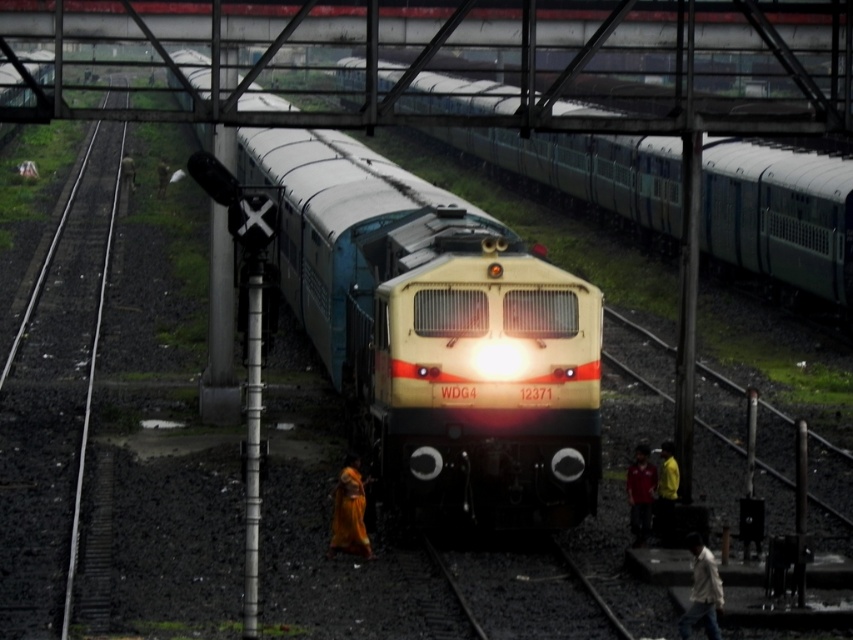
You are standing at the point marked by coordinates point (438, 333) in the railway scene. Which object is exactly at this location?

The point (438, 333) corresponds to the location of the matte yellow locomotive at center.

You are a railway engineer standing at the control center. You need to locate the matte yellow locomotive at center on the track map. What are its coordinates?

The coordinates of the matte yellow locomotive at center are at point [438,333].